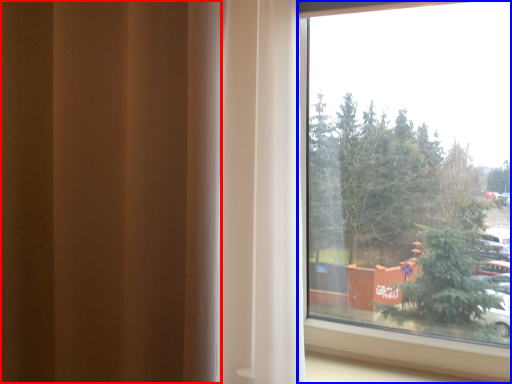
Question: Which object appears farthest to the camera in this image, curtain (highlighted by a red box) or window (highlighted by a blue box)?

Choices:
 (A) curtain
 (B) window

Answer: (B)